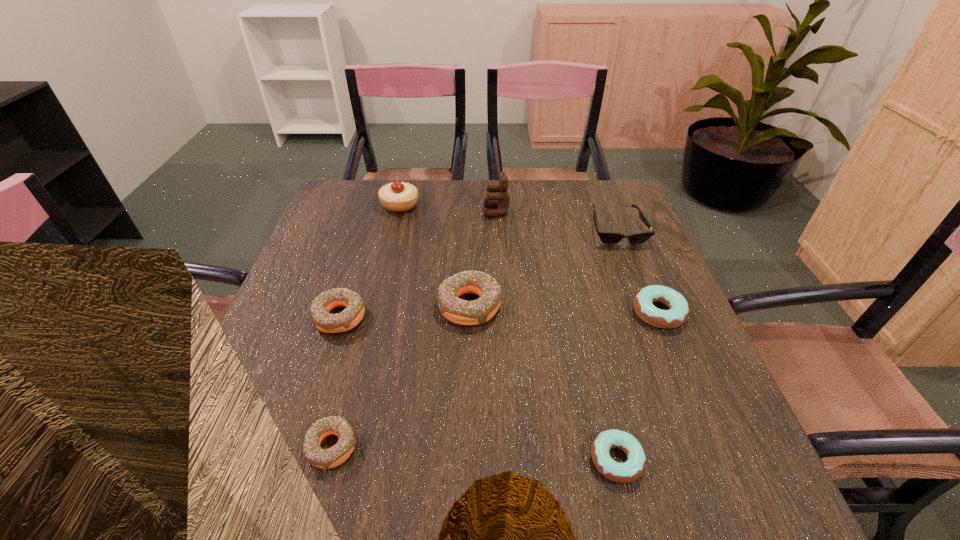
Select which chocolate doughnut is the closest to the nearest chocolate doughnut. Please provide its 2D coordinates. Your answer should be formatted as a tuple, i.e. [(x, y)], where the tuple contains the x and y coordinates of a point satisfying the conditions above.

[(351, 316)]

Locate an element on the screen. This screenshot has width=960, height=540. chocolate doughnut that can be found as the closest to the left blue doughnut is located at coordinates (459, 311).

The height and width of the screenshot is (540, 960). I want to click on free space that satisfies the following two spatial constraints: 1. on the back side of the smaller blue doughnut; 2. on the right side of the rightmost doughnut, so click(x=582, y=312).